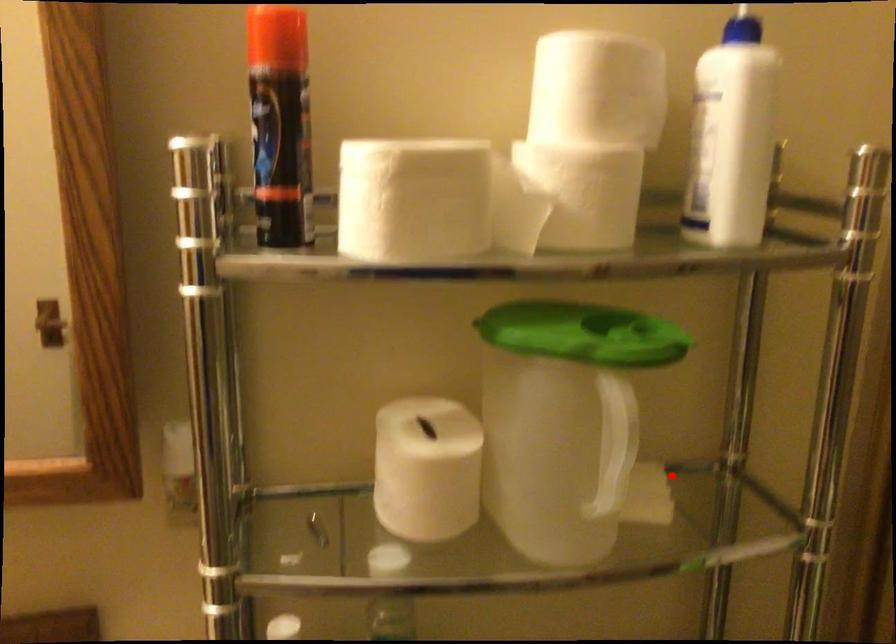
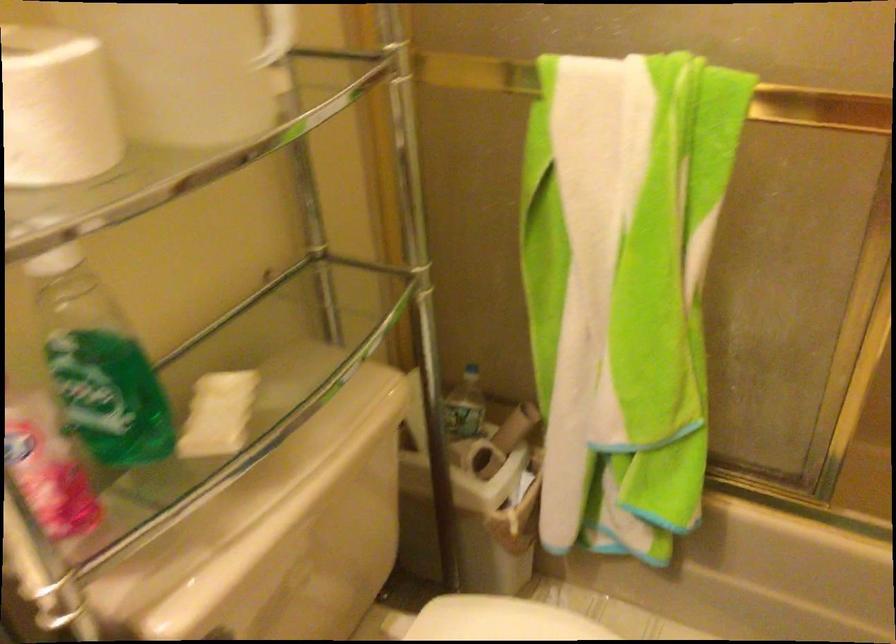
Locate, in the second image, the point that corresponds to the highlighted location in the first image.

(270, 64)